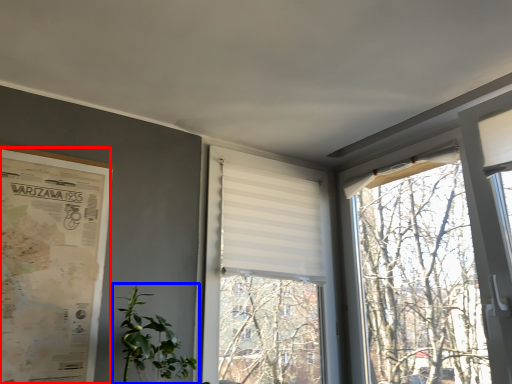
Question: Which of the following is the farthest to the observer, poster page (highlighted by a red box) or houseplant (highlighted by a blue box)?

Choices:
 (A) poster page
 (B) houseplant

Answer: (B)